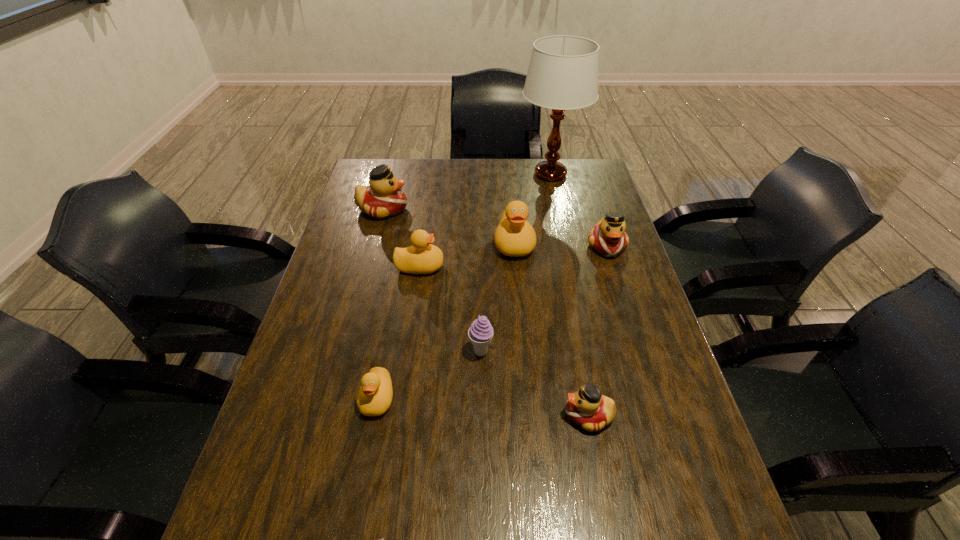
Where is `object that is the second closest to the table lamp`? This screenshot has width=960, height=540. object that is the second closest to the table lamp is located at coordinates (608, 237).

Locate an element on the screen. This screenshot has width=960, height=540. object that ranks as the fifth closest to the third duck from right to left is located at coordinates (480, 333).

At what (x,y) coordinates should I click in order to perform the action: click on duck that is the second nearest to the diary. Please return your answer as a coordinate pair (x, y). Looking at the image, I should click on (592, 411).

Locate an element on the screen. duck that is the second closest one to the second smallest yellow duck is located at coordinates (384, 198).

This screenshot has height=540, width=960. What are the coordinates of `red duck that is the second closest one to the biggest yellow duck` in the screenshot? It's located at (384, 198).

Locate an element on the screen. This screenshot has height=540, width=960. the closest red duck to the second farthest object is located at coordinates (608, 237).

I want to click on yellow duck that is the closest to the second biggest yellow duck, so click(x=515, y=236).

Where is `yellow duck that can be found as the third closest to the farthest duck`? yellow duck that can be found as the third closest to the farthest duck is located at coordinates (374, 398).

The image size is (960, 540). In order to click on free location that satisfies the following two spatial constraints: 1. on the face of the leftmost red duck; 2. on the left side of the icecream in this screenshot , I will do `click(344, 352)`.